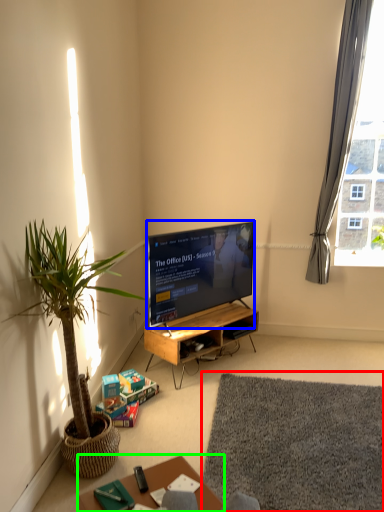
Question: Which object is positioned farthest from mat (highlighted by a red box)? Select from television (highlighted by a blue box) and table (highlighted by a green box).

Choices:
 (A) television
 (B) table

Answer: (A)